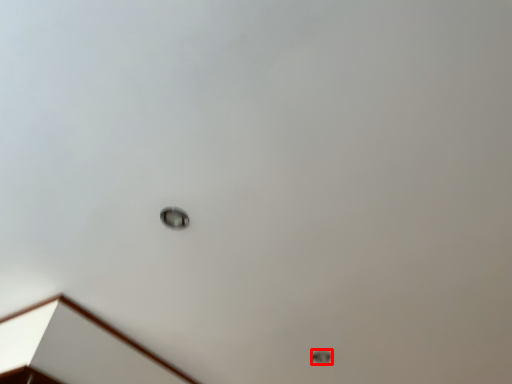
Question: Observing the image, what is the correct spatial positioning of lamp (annotated by the red box) in reference to dot?

Choices:
 (A) left
 (B) right

Answer: (B)